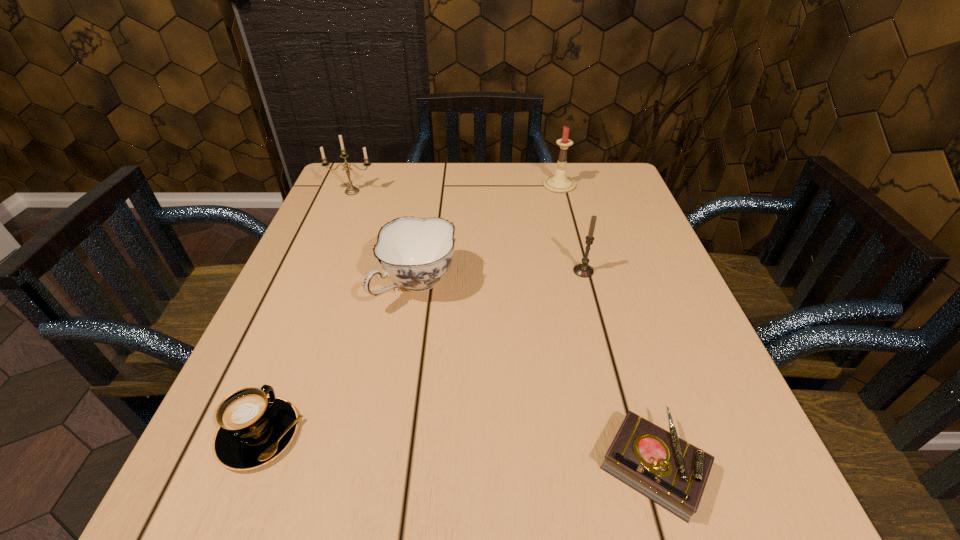
Locate which object ranks fifth in proximity to the nearest candle. Please provide its 2D coordinates. Your answer should be formatted as a tuple, i.e. [(x, y)], where the tuple contains the x and y coordinates of a point satisfying the conditions above.

[(351, 190)]

Select which object appears as the fourth closest to the diary. Please provide its 2D coordinates. Your answer should be formatted as a tuple, i.e. [(x, y)], where the tuple contains the x and y coordinates of a point satisfying the conditions above.

[(558, 183)]

Find the location of `candle identified as the second closest to the nearest candle`. candle identified as the second closest to the nearest candle is located at coordinates (351, 190).

Identify which candle is the second closest to the leftmost candle. Please provide its 2D coordinates. Your answer should be formatted as a tuple, i.e. [(x, y)], where the tuple contains the x and y coordinates of a point satisfying the conditions above.

[(583, 270)]

In order to click on free space in the image that satisfies the following two spatial constraints: 1. on the front side of the leftmost candle; 2. on the left side of the fourth object from right to left in this screenshot , I will do `click(314, 285)`.